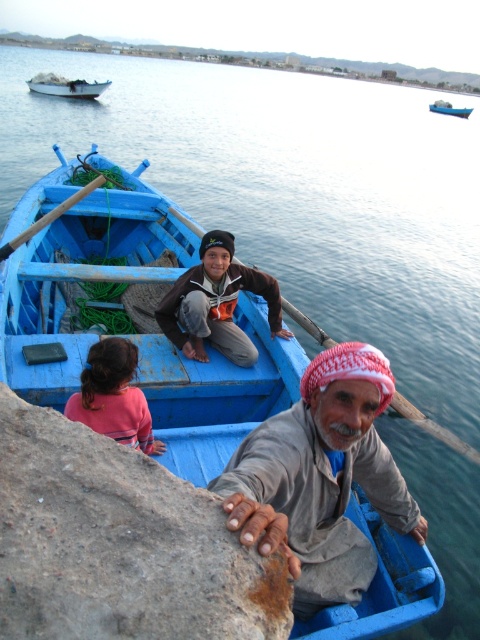
Can you confirm if brown cotton shirt at center is smaller than blue wooden boat at upper center?

Correct, brown cotton shirt at center occupies less space than blue wooden boat at upper center.

Is brown cotton shirt at center taller than blue wooden boat at upper center?

No.

Which is behind, point (197, 284) or point (447, 102)?

Point (447, 102)

Identify the location of brown cotton shirt at center. The image size is (480, 640). (216, 304).

Is matte blue boat at center thinner than white plastic boat at upper left?

In fact, matte blue boat at center might be wider than white plastic boat at upper left.

The image size is (480, 640). What do you see at coordinates (133, 304) in the screenshot? I see `matte blue boat at center` at bounding box center [133, 304].

Who is more forward, (107, 332) or (48, 76)?

Point (107, 332) is more forward.

Locate an element on the screen. matte blue boat at center is located at coordinates (133, 304).

Is the position of matte blue boat at center less distant than that of gray fabric headscarf at lower center?

No, it is behind gray fabric headscarf at lower center.

Does matte blue boat at center have a lesser width compared to gray fabric headscarf at lower center?

Incorrect, matte blue boat at center's width is not less than gray fabric headscarf at lower center's.

Where is `matte blue boat at center`? matte blue boat at center is located at coordinates (133, 304).